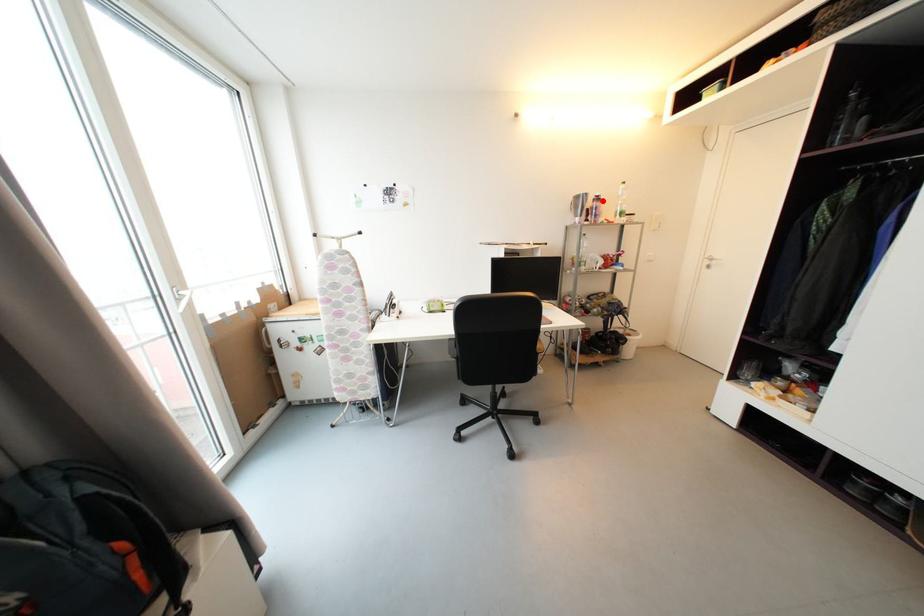
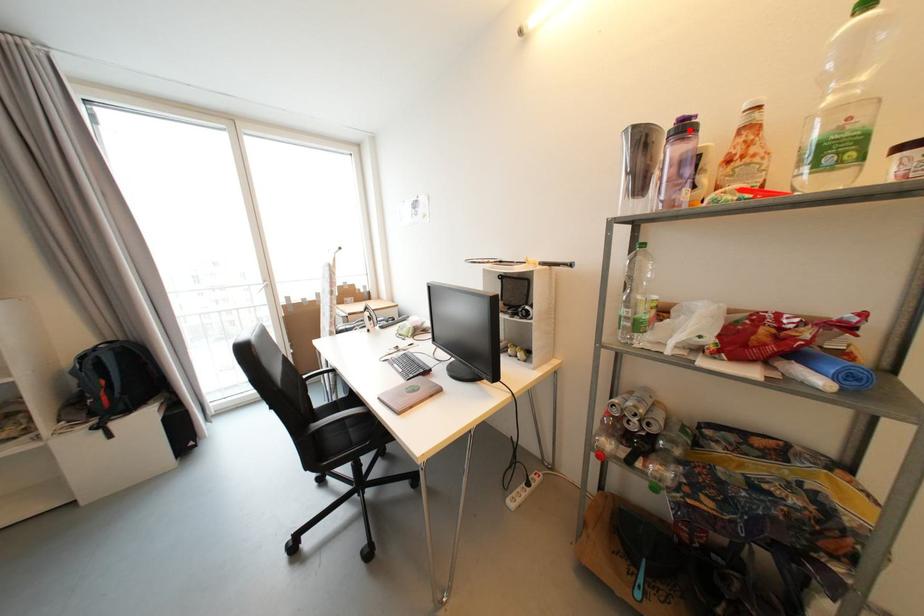
I am providing you with two images of the same scene from different viewpoints. A red point is marked on the first image and another point is marked on the second image. Is the marked point in image1 the same physical position as the marked point in image2?

Yes